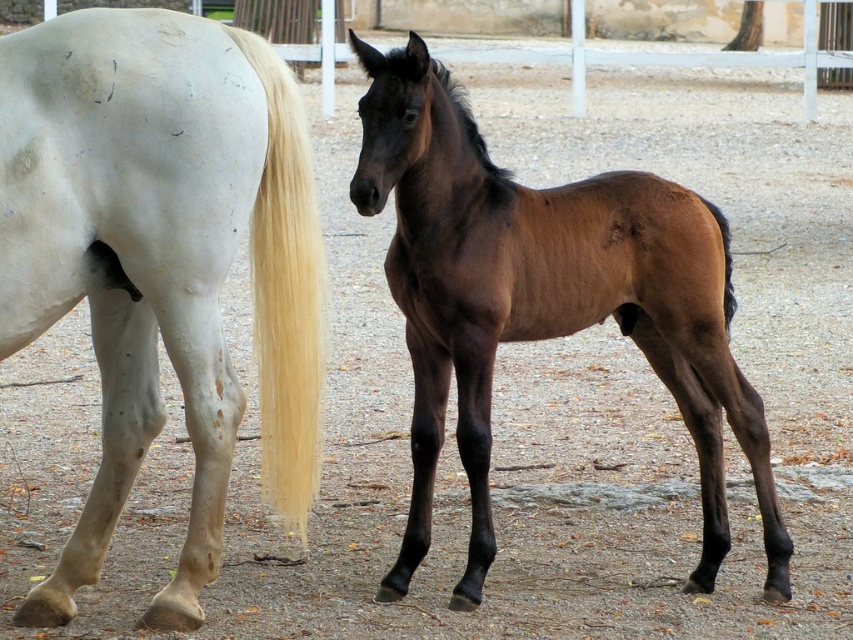
You are a horse trainer observing the two horses in the paddock. You notice the blonde silky tail at left and the brown glossy tail at right. Which tail belongs to the horse that is larger in size?

The blonde silky tail at left belongs to the horse that is larger in size because the blonde silky tail at left is larger in size than the brown glossy tail at right.

You are a farmer checking the paddock. You notice the white glossy horse at left and the brown glossy horse at center. Which horse is taller?

The white glossy horse at left is taller than the brown glossy horse at center.

You are a photographer trying to capture the black silky mane at center and the brown glossy tail at right in a single shot. Based on their positions, which object will appear closer to the camera in the photo?

The black silky mane at center will appear closer to the camera because it is positioned in front of the brown glossy tail at right.